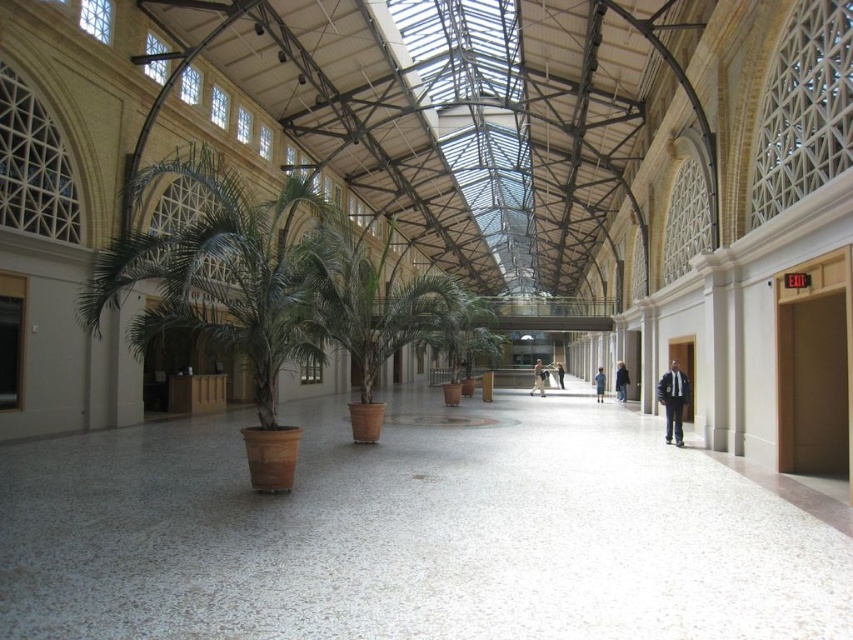
Between brown terracotta pot at left and dark blue jeans at center, which one has more height?

Standing taller between the two is brown terracotta pot at left.

Locate an element on the screen. brown terracotta pot at left is located at coordinates pyautogui.click(x=227, y=291).

Locate an element on the screen. The image size is (853, 640). brown terracotta pot at left is located at coordinates (227, 291).

Locate an element on the screen. The image size is (853, 640). brown terracotta pot at left is located at coordinates (227, 291).

Between point (672, 435) and point (537, 374), which one is positioned behind?

Point (537, 374)

Does dark blue suit at center have a greater width compared to brown leather jacket at center?

No.

The image size is (853, 640). I want to click on dark blue suit at center, so click(672, 401).

Who is higher up, brown leather jacket at center or dark blue jeans at center?

dark blue jeans at center

Which is more to the left, brown leather jacket at center or dark blue jeans at center?

brown leather jacket at center

Does point (538, 392) come closer to viewer compared to point (601, 371)?

That is False.

Where is `brown leather jacket at center`? brown leather jacket at center is located at coordinates (537, 378).